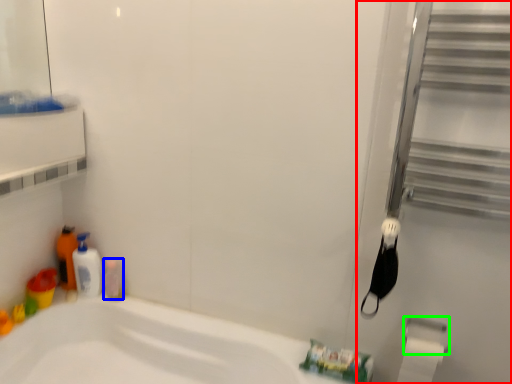
Question: Considering the real-world distances, which object is farthest from screen door (highlighted by a red box)? toiletry (highlighted by a blue box) or towel bar (highlighted by a green box)?

Choices:
 (A) toiletry
 (B) towel bar

Answer: (A)